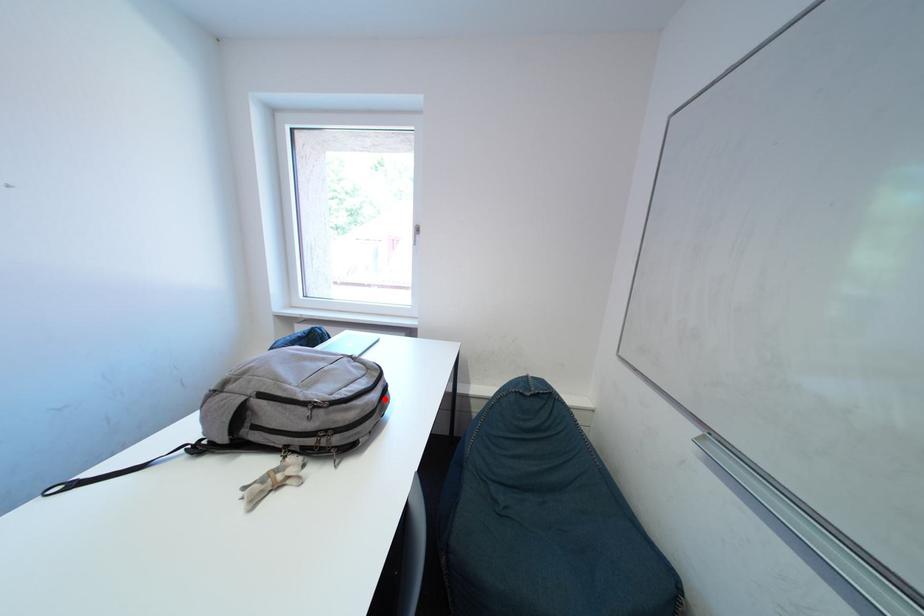
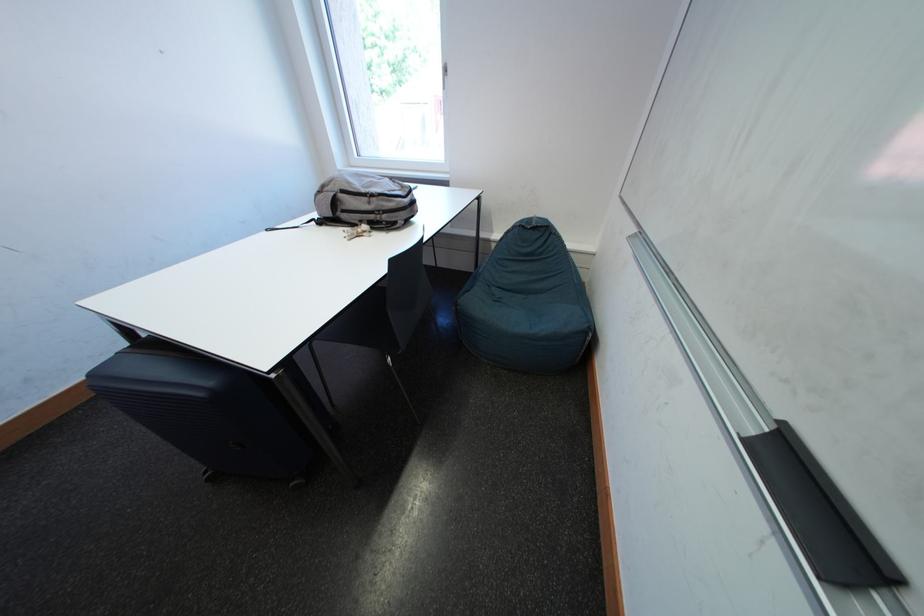
Question: I am providing you with two images of the same scene from different viewpoints. A red point is shown in image1. For the corresponding object point in image2, is it positioned nearer or farther from the camera?

Choices:
 (A) Nearer
 (B) Farther

Answer: (A)